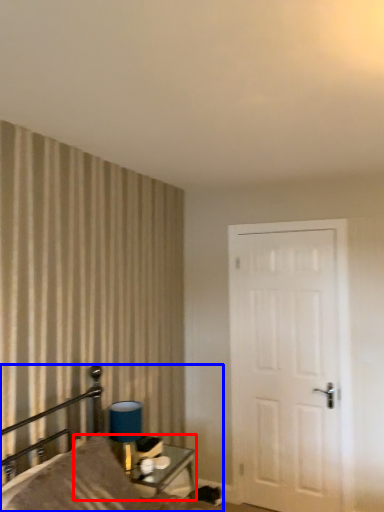
Question: Which of the following is the farthest to the observer, table (highlighted by a red box) or bed (highlighted by a blue box)?

Choices:
 (A) table
 (B) bed

Answer: (A)